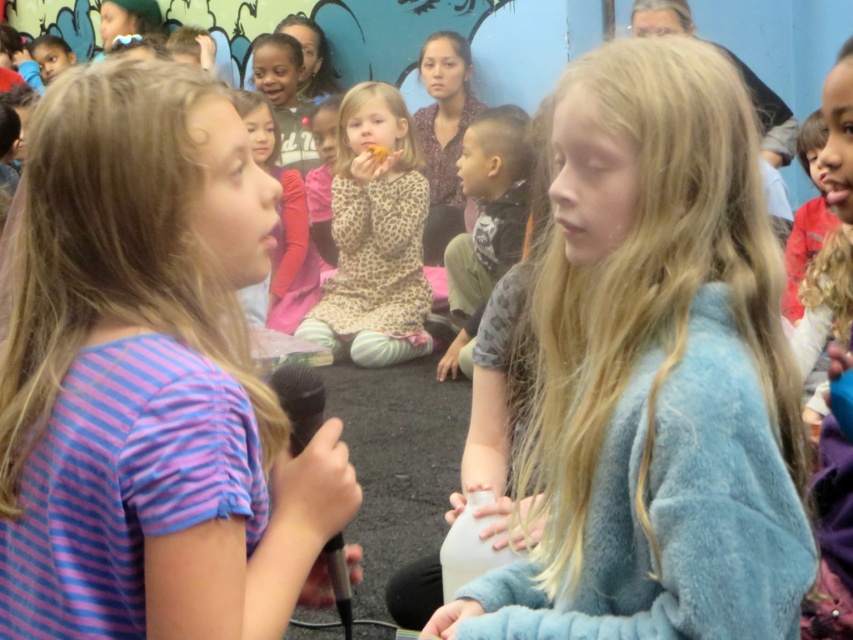
Question: From the image, what is the correct spatial relationship of purple striped shirt at center in relation to dark gray textured shirt at center?

Choices:
 (A) above
 (B) below

Answer: (B)

Question: Which is farther from the purple striped shirt at center?

Choices:
 (A) white matte bottle at center
 (B) dark gray textured shirt at center

Answer: (B)

Question: Which point is farther to the camera?

Choices:
 (A) (506, 257)
 (B) (643, 209)
 (C) (398, 248)

Answer: (C)

Question: Does purple striped shirt at center appear under white matte bottle at center?

Choices:
 (A) no
 (B) yes

Answer: (A)

Question: Is blue fuzzy sweater at center to the right of dark gray textured shirt at center from the viewer's perspective?

Choices:
 (A) yes
 (B) no

Answer: (A)

Question: Which point is farther to the camera?

Choices:
 (A) purple striped shirt at center
 (B) blue fuzzy sweater at center

Answer: (B)